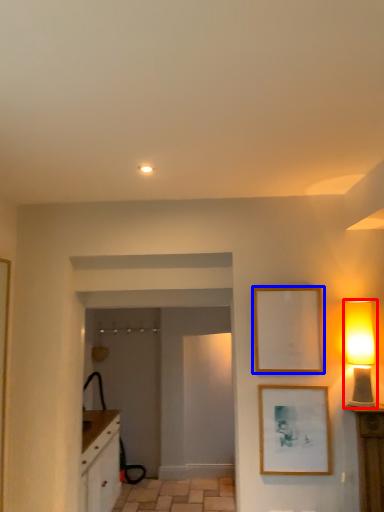
Question: Which object appears farthest to the camera in this image, table lamp (highlighted by a red box) or picture frame (highlighted by a blue box)?

Choices:
 (A) table lamp
 (B) picture frame

Answer: (B)